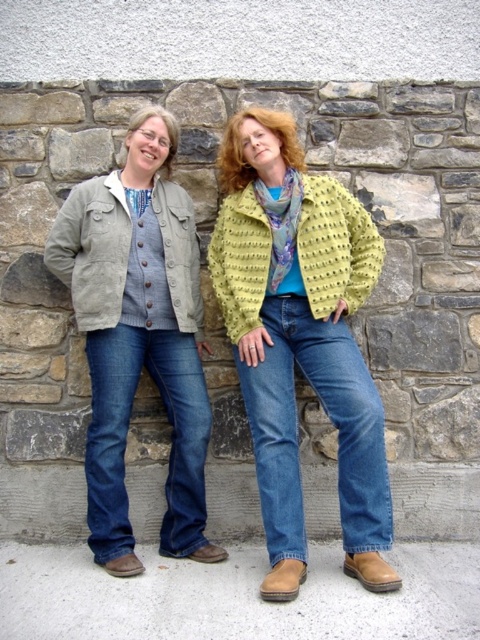
Question: Can you confirm if matte gray jacket at left is smaller than matte khaki jacket at left?

Choices:
 (A) yes
 (B) no

Answer: (B)

Question: Which object is farther from the camera taking this photo?

Choices:
 (A) matte gray jacket at left
 (B) matte gray jacket at center

Answer: (A)

Question: Can you confirm if matte gray jacket at left is wider than multicolored silk scarf at center?

Choices:
 (A) no
 (B) yes

Answer: (B)

Question: Estimate the real-world distances between objects in this image. Which object is closer to the multicolored silk scarf at center?

Choices:
 (A) matte khaki jacket at left
 (B) lime textured cardigan at center

Answer: (B)

Question: Is matte khaki jacket at left to the left of multicolored silk scarf at center from the viewer's perspective?

Choices:
 (A) no
 (B) yes

Answer: (B)

Question: Which of these objects is positioned closest to the matte khaki jacket at left?

Choices:
 (A) matte gray jacket at center
 (B) multicolored silk scarf at center

Answer: (A)